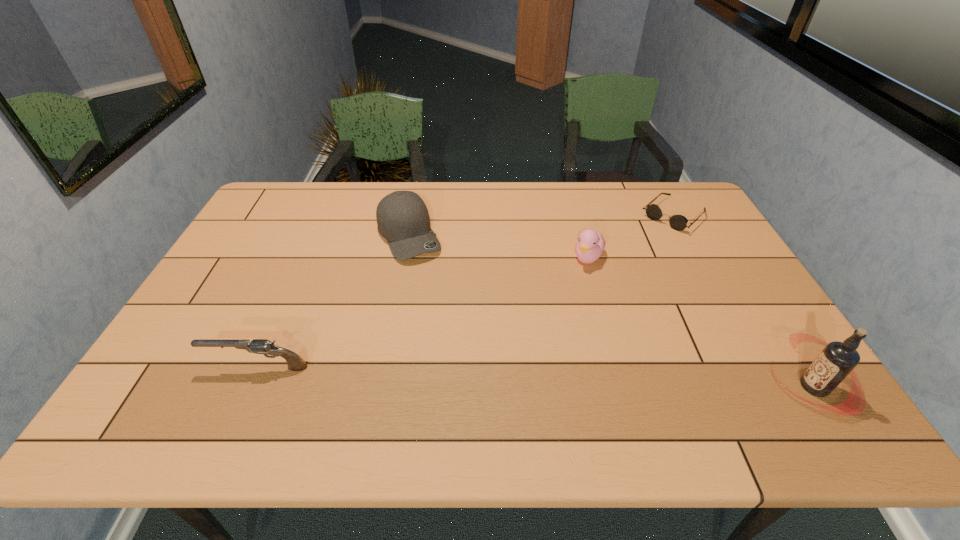
Where is `gun`? gun is located at coordinates (258, 346).

The image size is (960, 540). What are the coordinates of `root beer` in the screenshot? It's located at (838, 359).

The image size is (960, 540). What are the coordinates of `the third object from left to right` in the screenshot? It's located at coord(591,244).

What are the coordinates of `the fourth shortest object` in the screenshot? It's located at (403, 219).

The height and width of the screenshot is (540, 960). What are the coordinates of `the second object from left to right` in the screenshot? It's located at (403, 219).

At what (x,y) coordinates should I click in order to perform the action: click on the shortest object. Please return your answer as a coordinate pair (x, y). Image resolution: width=960 pixels, height=540 pixels. Looking at the image, I should click on (678, 222).

This screenshot has height=540, width=960. Find the location of `free space located aiming along the barrel of the leftmost object`. free space located aiming along the barrel of the leftmost object is located at coordinates (171, 367).

Locate an element on the screen. The height and width of the screenshot is (540, 960). vacant space located aiming along the barrel of the leftmost object is located at coordinates (163, 367).

Where is `vacant region located 0.120m aiming along the barrel of the leftmost object`? vacant region located 0.120m aiming along the barrel of the leftmost object is located at coordinates (158, 367).

The height and width of the screenshot is (540, 960). Identify the location of vacant space located on the label of the tallest object. (732, 387).